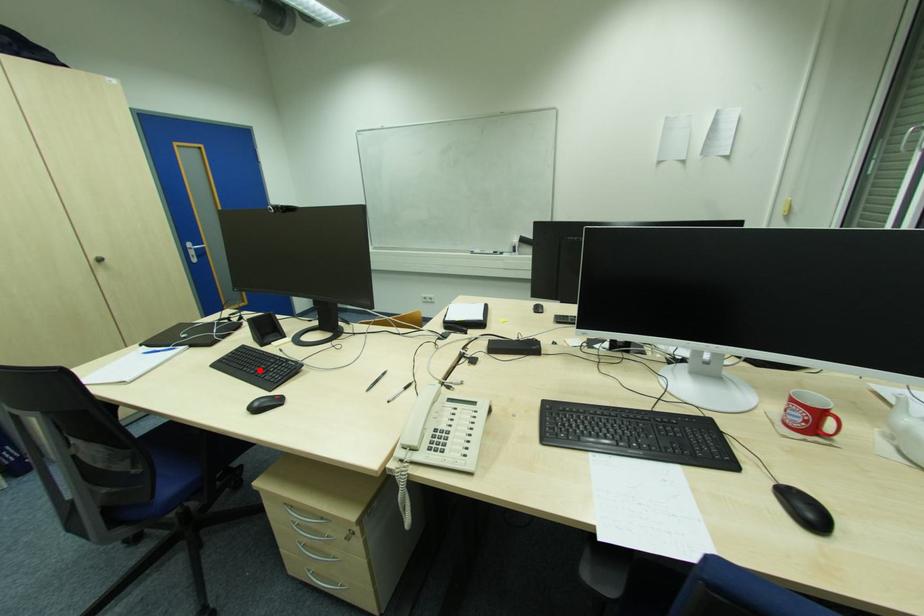
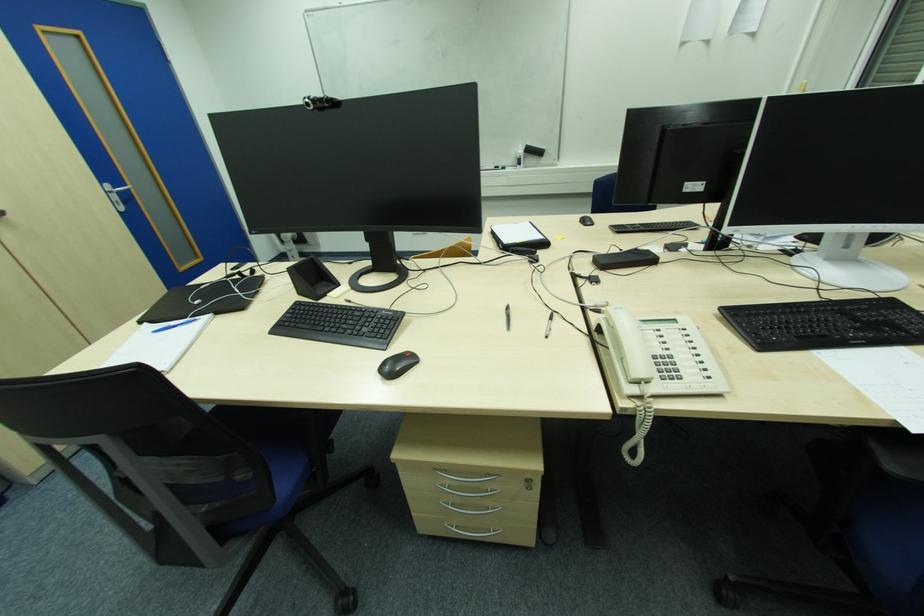
In the second image, find the point that corresponds to the highlighted location in the first image.

(346, 328)